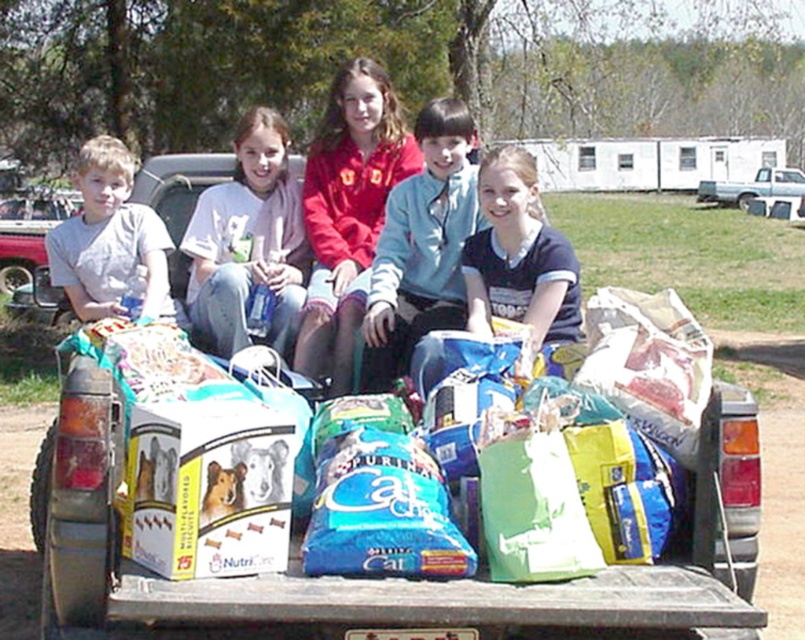
You are standing in front of the pickup truck and want to place a new bag of pet food between the two points labeled point (399, 132) and point (395, 260). Which point should you place the bag closer to so that it appears closer to you?

You should place the bag closer to point (399, 132) because it is closer to you than point (395, 260).

You are a photographer trying to capture a clear shot of the matte plastic bottle at center and the red fleece jacket at center. Since the bottle is partially hidden, where should you adjust your camera to focus more on the bottle?

The matte plastic bottle at center is positioned under the red fleece jacket at center, so you should adjust your camera to focus slightly downward to capture the bottle that is underneath.